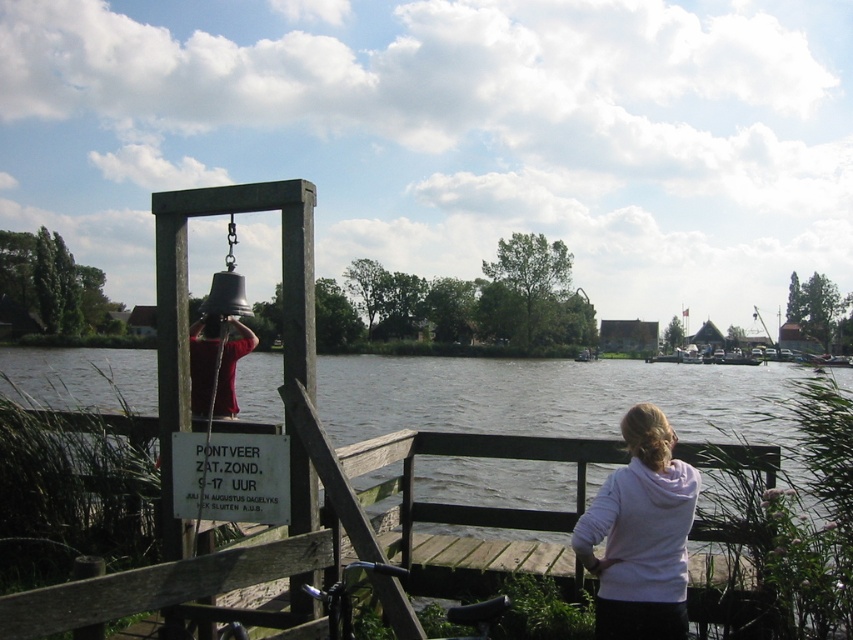
Can you confirm if white fleece jacket at lower right is shorter than dark gray plastic sign at lower center?

No, white fleece jacket at lower right is not shorter than dark gray plastic sign at lower center.

Who is more forward, (654, 579) or (280, 470)?

Point (654, 579)

Is point (651, 582) less distant than point (196, 502)?

Yes.

The height and width of the screenshot is (640, 853). Identify the location of white fleece jacket at lower right. (641, 534).

Which is in front, point (544, 515) or point (631, 468)?

Point (631, 468) is in front.

Does wooden at center have a lesser height compared to white fleece jacket at lower right?

Indeed, wooden at center has a lesser height compared to white fleece jacket at lower right.

Is point (740, 604) farther from viewer compared to point (618, 609)?

Yes, point (740, 604) is farther from viewer.

I want to click on wooden at center, so click(x=480, y=513).

In the scene shown: Is wooden at center wider than dark gray plastic sign at lower center?

Yes, wooden at center is wider than dark gray plastic sign at lower center.

Does point (582, 445) lie behind point (189, 449)?

Yes, point (582, 445) is behind point (189, 449).

Where is `wooden at center`? The height and width of the screenshot is (640, 853). wooden at center is located at coordinates (480, 513).